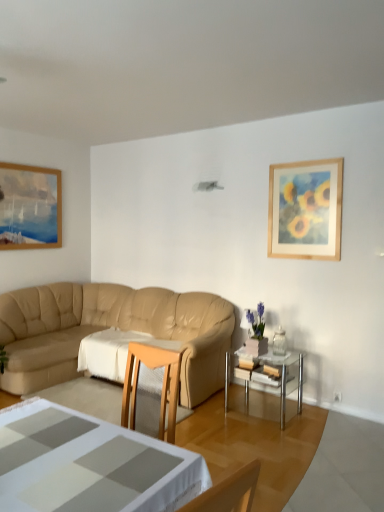
In the scene shown: What is the approximate width of clear glass table at center?

clear glass table at center is 20.29 inches wide.

The width and height of the screenshot is (384, 512). What do you see at coordinates (266, 376) in the screenshot? I see `clear glass table at center` at bounding box center [266, 376].

What do you see at coordinates (113, 351) in the screenshot? I see `white fabric tablecloth at center` at bounding box center [113, 351].

What do you see at coordinates (305, 209) in the screenshot? The width and height of the screenshot is (384, 512). I see `wooden framed painting at upper right` at bounding box center [305, 209].

Image resolution: width=384 pixels, height=512 pixels. What are the coordinates of `wooden framed painting at upper right` in the screenshot? It's located at (305, 209).

Where is `matte pink vase at right`? matte pink vase at right is located at coordinates (256, 321).

Identify the location of studio couch behind the white glossy coffee table at lower center. (108, 327).

Looking at this image, how different are the orientations of white glossy coffee table at lower center and beige leather couch at center in degrees?

They differ by 177 degrees in their facing directions.

From a real-world perspective, is white glossy coffee table at lower center physically located above or below beige leather couch at center?

In terms of real-world spatial position, white glossy coffee table at lower center is above beige leather couch at center.

Is point (21, 502) farther from viewer compared to point (209, 368)?

No, (21, 502) is closer to viewer.

Can you tell me how much matte pink vase at right and white glossy coffee table at lower center differ in facing direction?

The facing directions of matte pink vase at right and white glossy coffee table at lower center are 171 degrees apart.

Is matte pink vase at right located outside white glossy coffee table at lower center?

Yes.

How far apart are matte pink vase at right and white glossy coffee table at lower center?

matte pink vase at right is 7.53 feet from white glossy coffee table at lower center.

Does matte pink vase at right turn towards white glossy coffee table at lower center?

No, matte pink vase at right does not turn towards white glossy coffee table at lower center.

Based on the photo, from a real-world perspective, is beige leather couch at center physically located above or below matte pink vase at right?

beige leather couch at center is below matte pink vase at right.

Does beige leather couch at center come behind matte pink vase at right?

No, beige leather couch at center is closer to the camera.

Which of these two, beige leather couch at center or matte pink vase at right, is smaller?

Smaller between the two is matte pink vase at right.

Looking at this image, considering the sizes of objects beige leather couch at center and white glossy coffee table at lower center in the image provided, who is thinner, beige leather couch at center or white glossy coffee table at lower center?

Thinner between the two is white glossy coffee table at lower center.

Who is smaller, beige leather couch at center or white glossy coffee table at lower center?

white glossy coffee table at lower center is smaller.

From a real-world perspective, who is located higher, beige leather couch at center or white glossy coffee table at lower center?

white glossy coffee table at lower center, from a real-world perspective.

Is white glossy coffee table at lower center at the back of beige leather couch at center?

beige leather couch at center does not have its back to white glossy coffee table at lower center.

Is white glossy coffee table at lower center spatially inside wooden framed painting at upper right, or outside of it?

white glossy coffee table at lower center is spatially situated outside wooden framed painting at upper right.

From a real-world perspective, between white glossy coffee table at lower center and wooden framed painting at upper right, who is vertically lower?

white glossy coffee table at lower center, from a real-world perspective.

Would you say white glossy coffee table at lower center is to the left or to the right of wooden framed painting at upper right in the picture?

In the image, white glossy coffee table at lower center appears on the left side of wooden framed painting at upper right.

Consider the image. Looking at their sizes, would you say white glossy coffee table at lower center is wider or thinner than wooden framed painting at upper right?

white glossy coffee table at lower center is wider than wooden framed painting at upper right.

Is clear glass table at center spatially inside wooden framed painting at upper right, or outside of it?

clear glass table at center is not inside wooden framed painting at upper right, it's outside.

Considering the sizes of clear glass table at center and wooden framed painting at upper right in the image, is clear glass table at center bigger or smaller than wooden framed painting at upper right?

Clearly, clear glass table at center is larger in size than wooden framed painting at upper right.

Is clear glass table at center aimed at wooden framed painting at upper right?

No, clear glass table at center is not turned towards wooden framed painting at upper right.

Can you confirm if clear glass table at center is positioned to the right of wooden framed painting at upper right?

No.

Does white fabric tablecloth at center turn towards wooden framed painting at upper right?

No, white fabric tablecloth at center is not aimed at wooden framed painting at upper right.

From their relative heights in the image, would you say white fabric tablecloth at center is taller or shorter than wooden framed painting at upper right?

Clearly, white fabric tablecloth at center is shorter compared to wooden framed painting at upper right.

Can you confirm if white fabric tablecloth at center is wider than wooden framed painting at upper right?

Correct, the width of white fabric tablecloth at center exceeds that of wooden framed painting at upper right.

Which is correct: white fabric tablecloth at center is inside wooden framed painting at upper right, or outside of it?

The correct answer is: outside.

You are a GUI agent. You are given a task and a screenshot of the screen. Output one action in this format:
    pyautogui.click(x=<x>, y=<y>)
    Task: Click on the coffee table above the beige leather couch at center (from a real-world perspective)
    
    Given the screenshot: What is the action you would take?
    pyautogui.click(x=90, y=465)

At what (x,y) coordinates should I click in order to perform the action: click on coffee table that is in front of the matte pink vase at right. Please return your answer as a coordinate pair (x, y). Looking at the image, I should click on (90, 465).

Estimate the real-world distances between objects in this image. Which object is further from clear glass table at center, white glossy coffee table at lower center or beige leather couch at center?

Among the two, white glossy coffee table at lower center is located further to clear glass table at center.

Based on their spatial positions, is clear glass table at center or white glossy coffee table at lower center closer to beige leather couch at center?

clear glass table at center is positioned closer to the anchor beige leather couch at center.

From the image, which object appears to be farther from matte pink vase at right, clear glass table at center or white glossy coffee table at lower center?

Based on the image, white glossy coffee table at lower center appears to be further to matte pink vase at right.

Looking at the image, which one is located closer to white fabric tablecloth at center, beige leather couch at center or clear glass table at center?

beige leather couch at center lies closer to white fabric tablecloth at center than the other object.

Looking at the image, which one is located closer to matte pink vase at right, white fabric tablecloth at center or clear glass table at center?

Based on the image, clear glass table at center appears to be nearer to matte pink vase at right.

Considering their positions, is matte pink vase at right positioned further to wooden framed painting at upper right than white glossy coffee table at lower center?

The object further to wooden framed painting at upper right is white glossy coffee table at lower center.

In the scene shown: When comparing their distances from wooden framed painting at upper right, does clear glass table at center or beige leather couch at center seem further?

Among the two, beige leather couch at center is located further to wooden framed painting at upper right.

Based on their spatial positions, is beige leather couch at center or white fabric tablecloth at center further from wooden framed painting at upper right?

white fabric tablecloth at center lies further to wooden framed painting at upper right than the other object.

Image resolution: width=384 pixels, height=512 pixels. I want to click on studio couch between white glossy coffee table at lower center and matte pink vase at right along the z-axis, so click(108, 327).

At what (x,y) coordinates should I click in order to perform the action: click on table between white glossy coffee table at lower center and wooden framed painting at upper right in the front-back direction. Please return your answer as a coordinate pair (x, y). Image resolution: width=384 pixels, height=512 pixels. Looking at the image, I should click on (266, 376).

Where is `tablecloth situated between beige leather couch at center and wooden framed painting at upper right from left to right`? This screenshot has width=384, height=512. tablecloth situated between beige leather couch at center and wooden framed painting at upper right from left to right is located at coordinates 113,351.

Image resolution: width=384 pixels, height=512 pixels. In order to click on table between beige leather couch at center and wooden framed painting at upper right in this screenshot , I will do `click(266, 376)`.